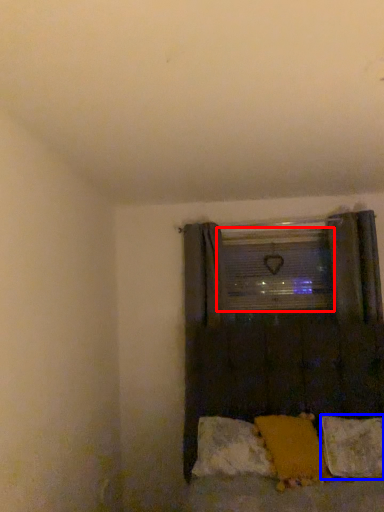
Question: Among these objects, which one is farthest to the camera, window screen (highlighted by a red box) or pillow (highlighted by a blue box)?

Choices:
 (A) window screen
 (B) pillow

Answer: (A)